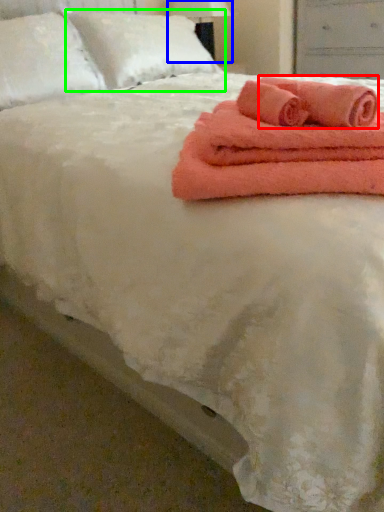
Question: Considering the real-world distances, which object is farthest from bath towel (highlighted by a red box)? bedside lamp (highlighted by a blue box) or pillow (highlighted by a green box)?

Choices:
 (A) bedside lamp
 (B) pillow

Answer: (A)